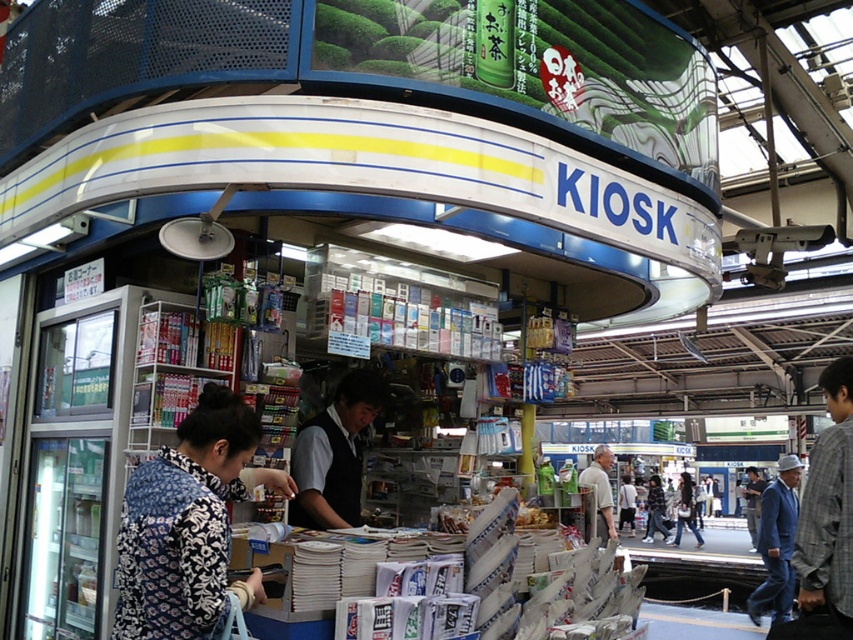
Question: Can you confirm if blue denim jacket at lower right is positioned below light gray shirt at center?

Choices:
 (A) yes
 (B) no

Answer: (A)

Question: Which object appears closest to the camera in this image?

Choices:
 (A) printed fabric blouse at center
 (B) plaid shirt at center
 (C) gray plaid shirt at right

Answer: (A)

Question: Which of the following is the farthest from the observer?

Choices:
 (A) (541, 509)
 (B) (654, 515)
 (C) (149, 506)

Answer: (B)

Question: Is printed fabric blouse at center thinner than blue denim jacket at lower right?

Choices:
 (A) yes
 (B) no

Answer: (A)

Question: Which of the following is the closest to the observer?

Choices:
 (A) blue denim jacket at lower right
 (B) dark gray fabric jacket at center

Answer: (A)

Question: Is plaid shirt at center positioned behind golden crispy snack at center?

Choices:
 (A) no
 (B) yes

Answer: (B)